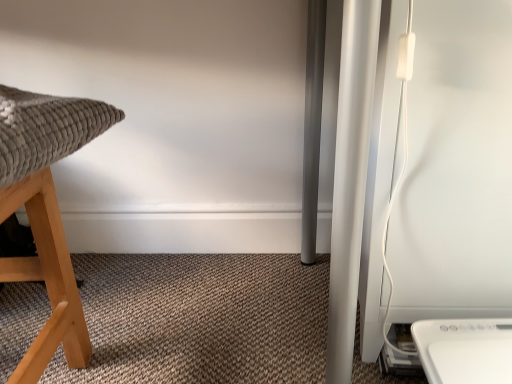
The image size is (512, 384). In order to click on white plastic appliance at right in this screenshot , I will do `click(456, 168)`.

This screenshot has height=384, width=512. What do you see at coordinates (456, 168) in the screenshot?
I see `white plastic appliance at right` at bounding box center [456, 168].

The height and width of the screenshot is (384, 512). In order to click on white plastic appliance at right in this screenshot , I will do `click(456, 168)`.